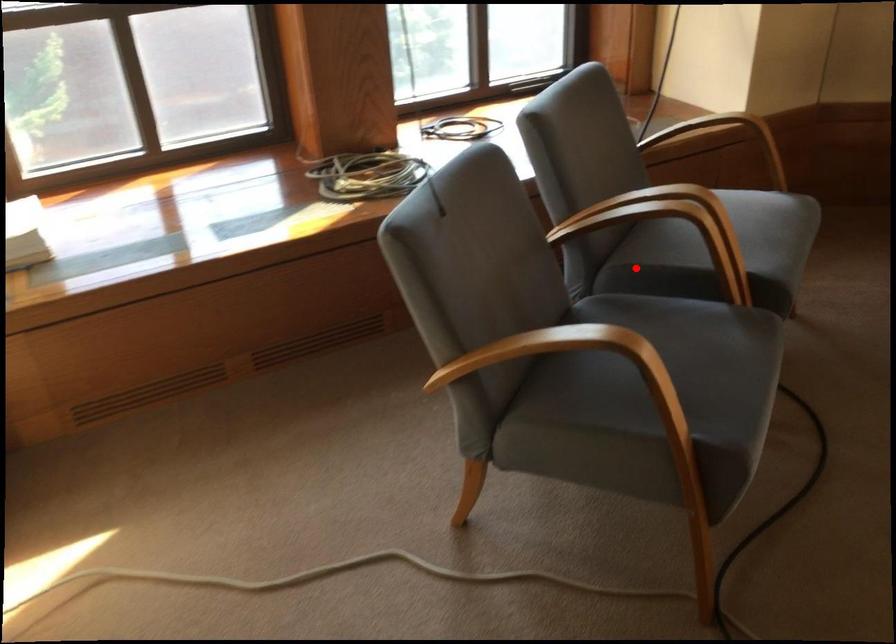
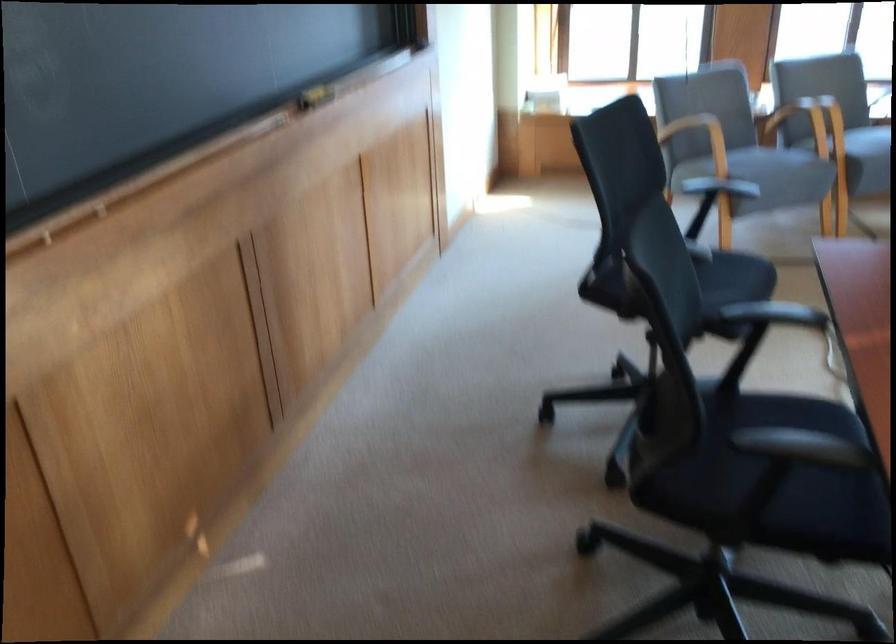
Question: I am providing you with two images of the same scene from different viewpoints. A red point is shown in image1. For the corresponding object point in image2, is it positioned nearer or farther from the camera?

Choices:
 (A) Nearer
 (B) Farther

Answer: (B)